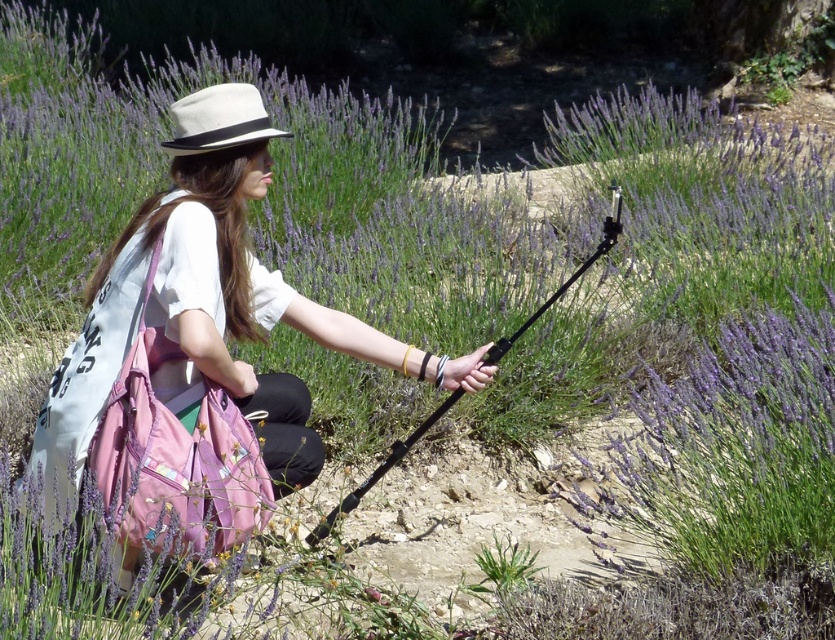
Who is lower down, pink fabric bag at center or black matte tripod at center?

black matte tripod at center is below.

Describe the element at coordinates (209, 326) in the screenshot. The width and height of the screenshot is (835, 640). I see `pink fabric bag at center` at that location.

Identify the location of pink fabric bag at center. (209, 326).

Is pink fabric bag at center shorter than white felt fedora at upper center?

No.

Is point (294, 461) in front of point (254, 92)?

No, it is not.

You are a GUI agent. You are given a task and a screenshot of the screen. Output one action in this format:
    pyautogui.click(x=<x>, y=<y>)
    Task: Click on the pink fabric bag at center
    This screenshot has height=640, width=835.
    Given the screenshot: What is the action you would take?
    pyautogui.click(x=209, y=326)

Is white felt fedora at upper center above black matte tripod at center?

Yes, white felt fedora at upper center is above black matte tripod at center.

The width and height of the screenshot is (835, 640). Describe the element at coordinates (218, 120) in the screenshot. I see `white felt fedora at upper center` at that location.

Locate an element on the screen. white felt fedora at upper center is located at coordinates (218, 120).

In order to click on white felt fedora at upper center in this screenshot , I will do `click(218, 120)`.